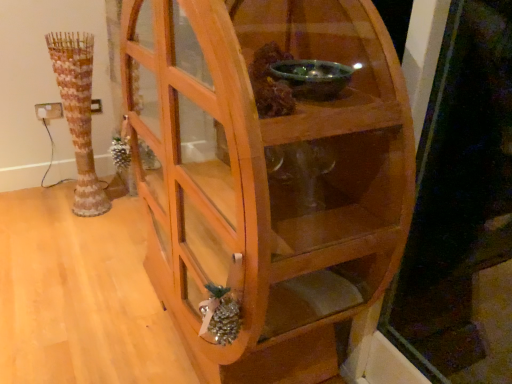
Where is `free space to the left of wooden textured vase at left`? free space to the left of wooden textured vase at left is located at coordinates (55, 211).